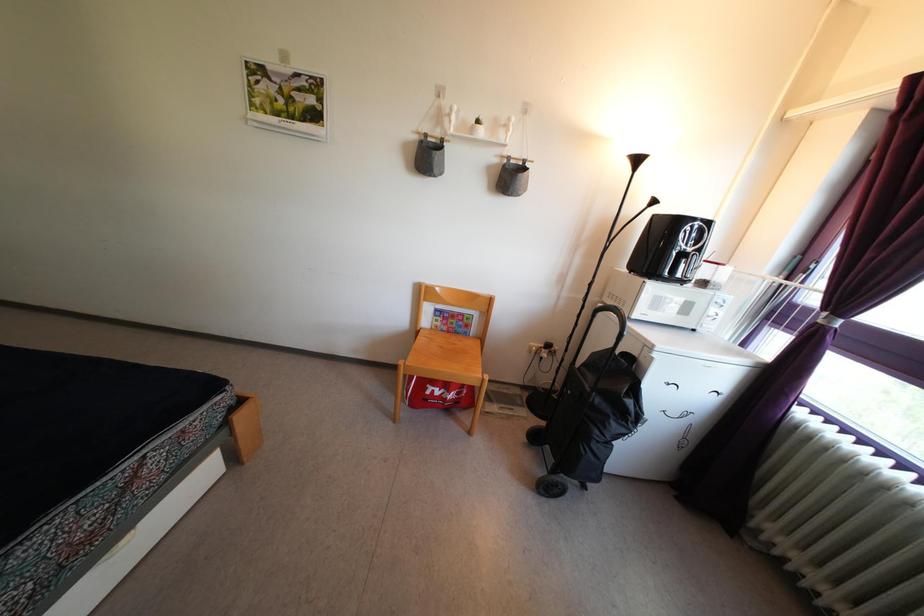
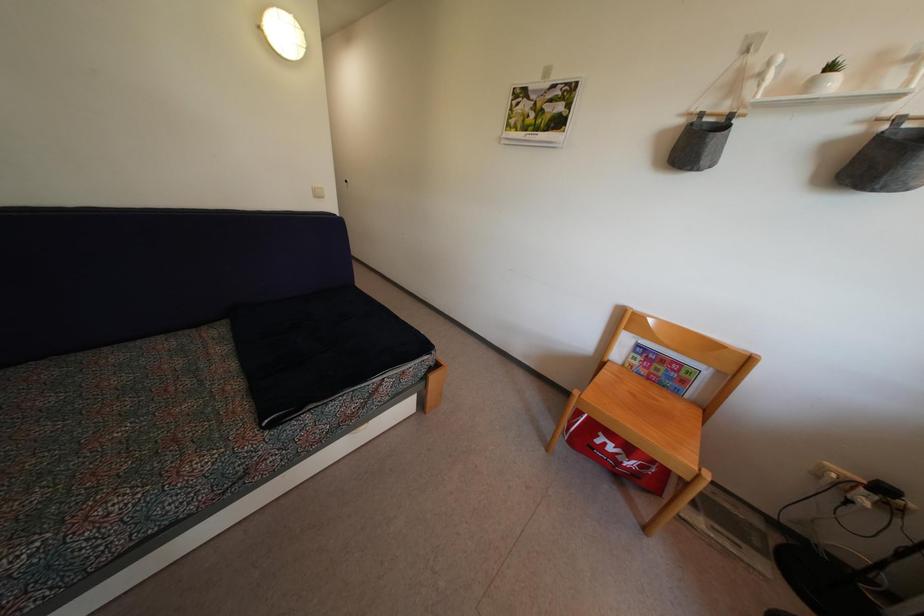
Question: The camera is either moving clockwise (left) or counter-clockwise (right) around the object. The first image is from the beginning of the video and the second image is from the end. Is the camera moving left or right when shooting the video?

Choices:
 (A) Left
 (B) Right

Answer: (B)